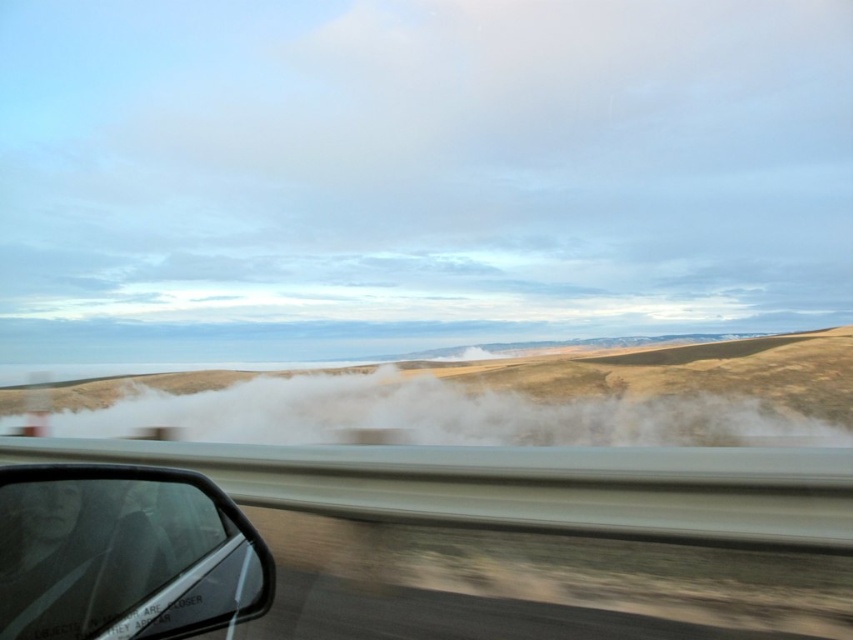
You are a passenger in a car and want to know where the transparent plastic car window at lower left is located. Can you describe its position using coordinates?

The transparent plastic car window at lower left is located at coordinates point [125,554].

You are sitting in the front passenger seat of the car and notice two points on the windshield. One is at coordinates point (763, 288) and the other at point (410, 420). Which point is closer to your face?

Point (763, 288) is further to the viewer than point (410, 420), so the point closer to your face is point (410, 420).